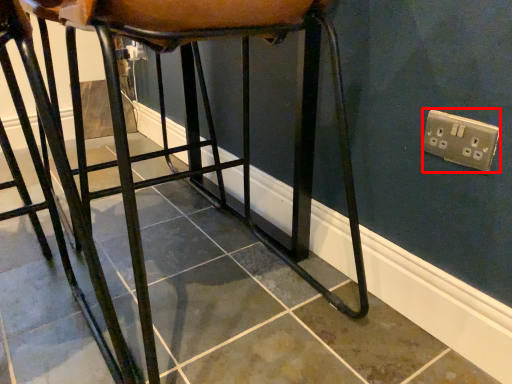
Question: Where is electric outlet (annotated by the red box) located in relation to furniture in the image?

Choices:
 (A) right
 (B) left

Answer: (A)